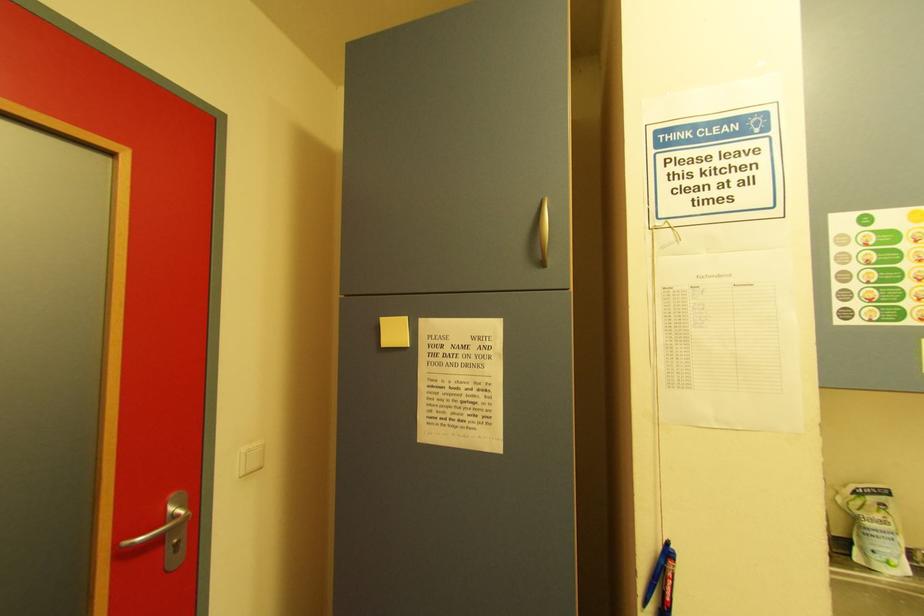
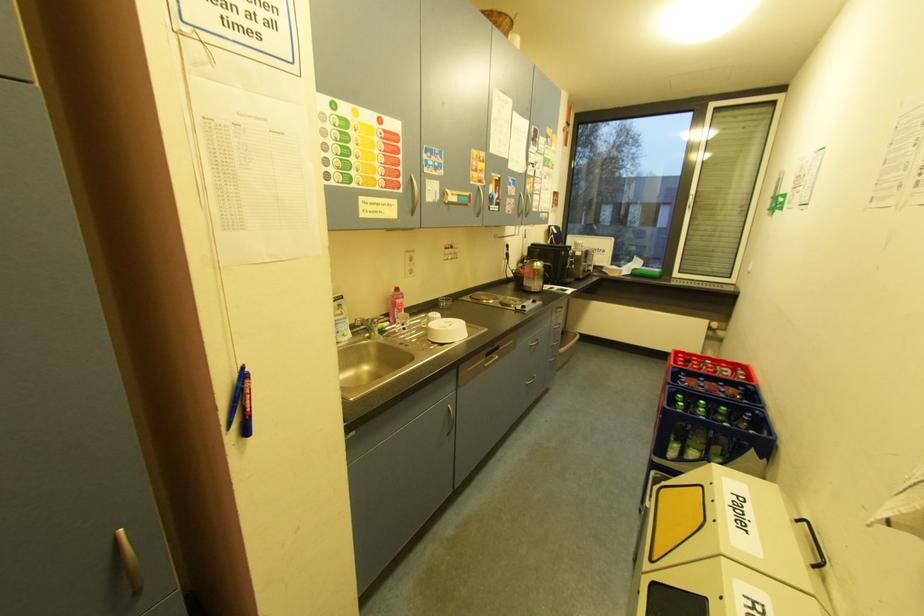
How did the camera likely rotate?

The rotation direction of the camera is right-down.